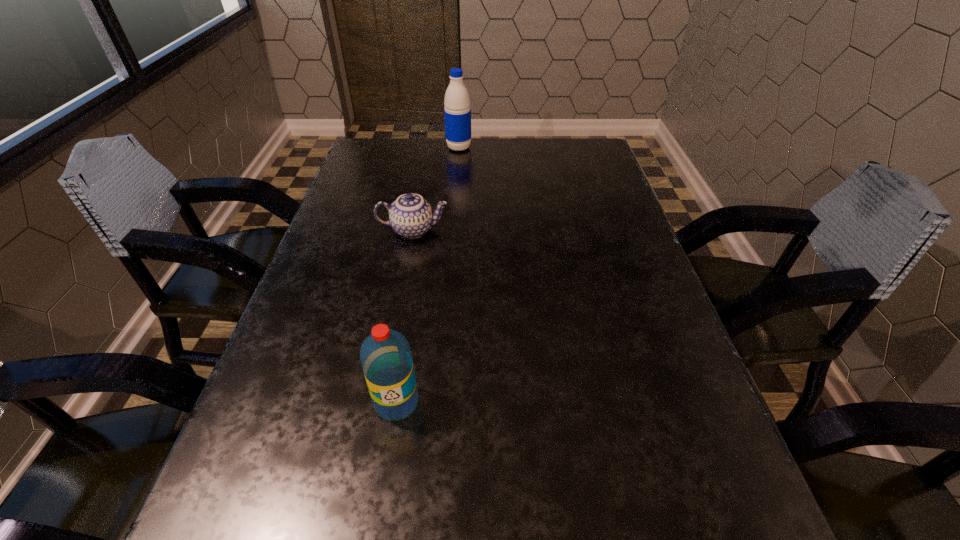
Where is `the farther water bottle`? The height and width of the screenshot is (540, 960). the farther water bottle is located at coordinates (457, 111).

Locate an element on the screen. The image size is (960, 540). the tallest object is located at coordinates (457, 111).

The height and width of the screenshot is (540, 960). In order to click on the nearer water bottle in this screenshot , I will do `click(386, 359)`.

At what (x,y) coordinates should I click in order to perform the action: click on the nearest object. Please return your answer as a coordinate pair (x, y). The height and width of the screenshot is (540, 960). Looking at the image, I should click on (386, 359).

You are a GUI agent. You are given a task and a screenshot of the screen. Output one action in this format:
    pyautogui.click(x=<x>, y=<y>)
    Task: Click on the second farthest object
    The image size is (960, 540).
    Given the screenshot: What is the action you would take?
    pyautogui.click(x=411, y=216)

At what (x,y) coordinates should I click in order to perform the action: click on chinaware. Please return your answer as a coordinate pair (x, y). The width and height of the screenshot is (960, 540). Looking at the image, I should click on tap(411, 216).

Where is `vacant region located 0.240m on the right of the taller water bottle`? vacant region located 0.240m on the right of the taller water bottle is located at coordinates (547, 147).

Locate an element on the screen. The image size is (960, 540). blank space located on the front label of the second tallest object is located at coordinates (381, 501).

This screenshot has height=540, width=960. I want to click on free region located from the spout of the second farthest object, so click(x=566, y=230).

Find the location of a particular element. The image size is (960, 540). object at the far edge is located at coordinates (457, 111).